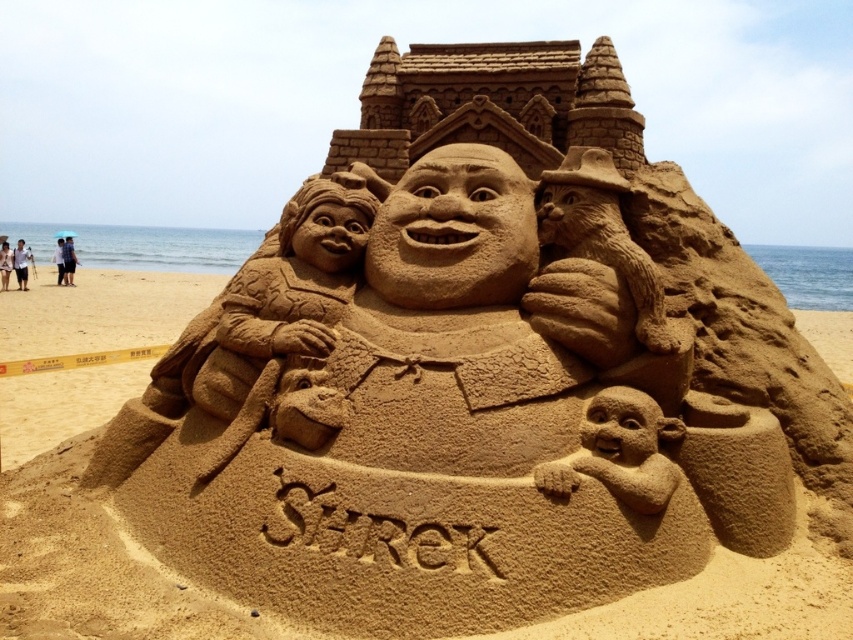
You are standing on the beach and want to take a photo of the smooth sand sculpture at center. Where should you position yourself to capture it in the frame?

You should position yourself at point [91,531] to capture the smooth sand sculpture at center in the frame.

You are a photographer wanting to take a picture of the smooth sand sculpture at center without any obstructions. The dark blue fabric umbrella at upper left is in the way. Can you move the umbrella to the side so that it doesn not block the view of the sand sculpture?

The smooth sand sculpture at center is below the dark blue fabric umbrella at upper left, so moving the umbrella to the side would allow the photographer to capture the sand sculpture without obstruction.